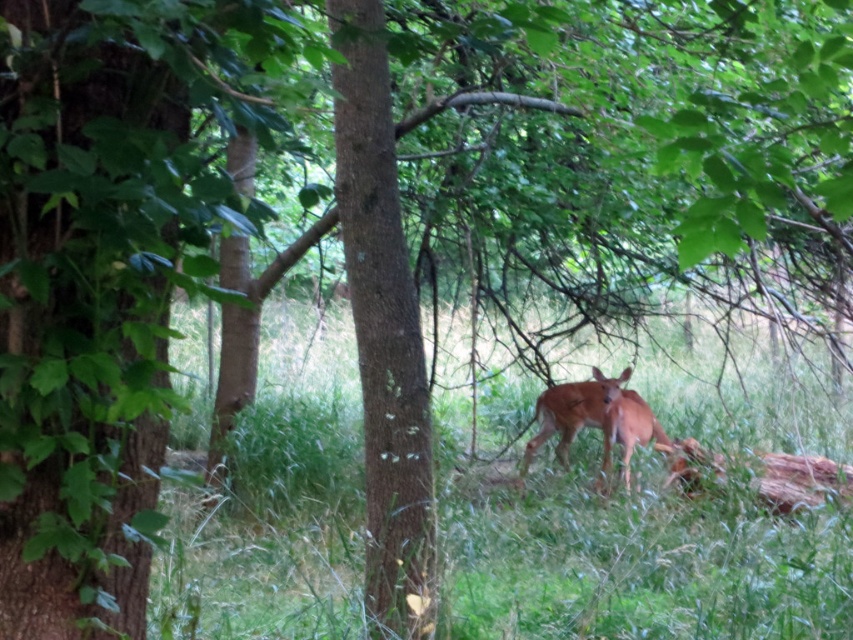
You are standing in the forest and want to place a small picnic basket on the ground near the deer. According to the image, where exactly should you place the basket to ensure it lands on the green grass at center?

You should place the basket at point [625,552] to ensure it lands on the green grass at center.

You are standing in the forest and see two points marked in the image. Which point is nearer to you, point (489, 609) or point (612, 413)?

Point (489, 609) is closer to the viewer than point (612, 413).